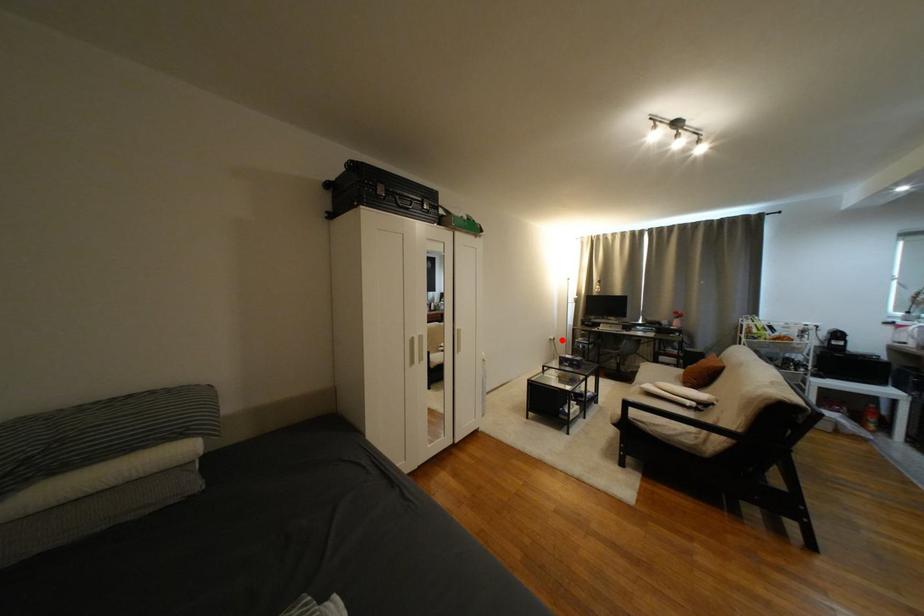
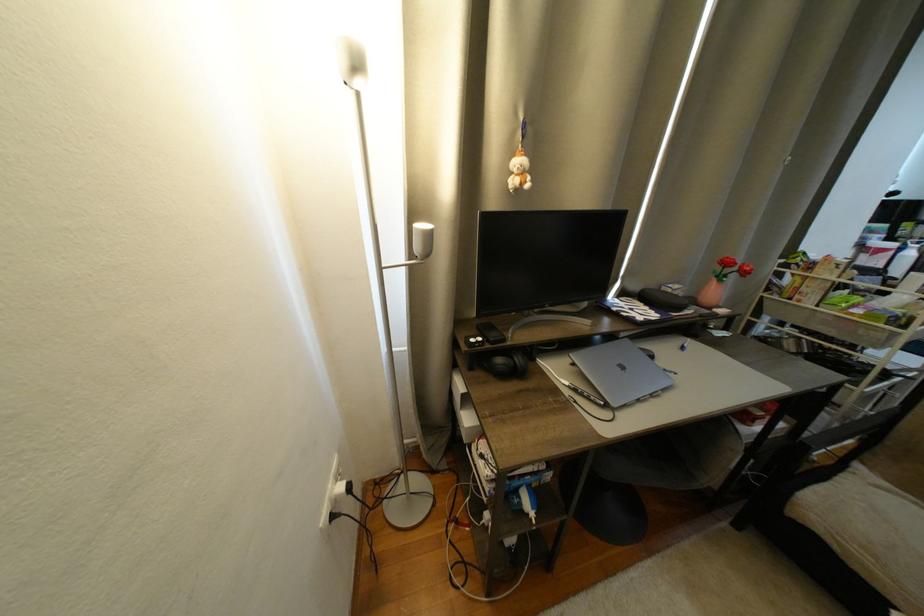
Question: I am providing you with two images of the same scene from different viewpoints. A red point is marked on the first image. At the location where the point appears in image 1, is it still visible in image 2?

Choices:
 (A) Yes
 (B) No

Answer: (A)